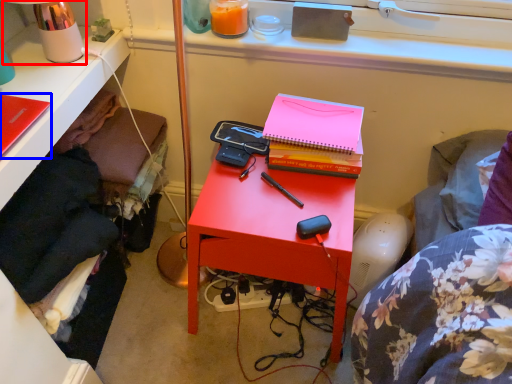
Question: Which object appears farthest to the camera in this image, table lamp (highlighted by a red box) or notebook (highlighted by a blue box)?

Choices:
 (A) table lamp
 (B) notebook

Answer: (A)